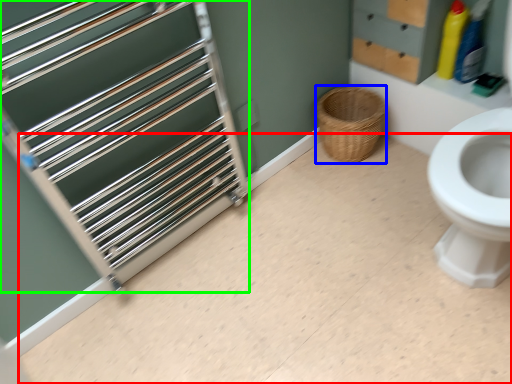
Question: Which is farther away from plain (highlighted by a red box)? basket (highlighted by a blue box) or cage (highlighted by a green box)?

Choices:
 (A) basket
 (B) cage

Answer: (A)